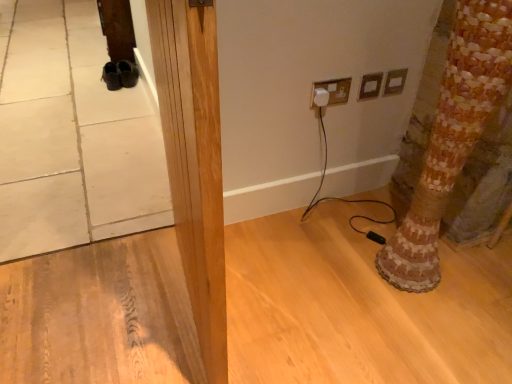
Question: From a real-world perspective, is natural wood pillar at center positioned above or below white plastic plug at upper center, the 1th electric outlet from the left?

Choices:
 (A) above
 (B) below

Answer: (A)

Question: Choose the correct answer: Is natural wood pillar at center inside white plastic plug at upper center, the 1th electric outlet from the left, or outside it?

Choices:
 (A) outside
 (B) inside

Answer: (A)

Question: Estimate the real-world distances between objects in this image. Which object is closer to the natural wood pillar at center?

Choices:
 (A) wooden mosaic tree trunk at lower right
 (B) white plastic plug at upper center, the 1th electric outlet from the left
 (C) matte plastic electric outlet at upper right, the first electric outlet viewed from the right
 (D) matte plastic outlet at upper right, acting as the 2th electric outlet starting from the left

Answer: (A)

Question: Which is farther from the white plastic plug at upper center, the 1th electric outlet from the left?

Choices:
 (A) matte plastic electric outlet at upper right, which is the 3th electric outlet from left to right
 (B) matte plastic outlet at upper right, acting as the 2th electric outlet starting from the left
 (C) natural wood pillar at center
 (D) wooden mosaic tree trunk at lower right

Answer: (C)